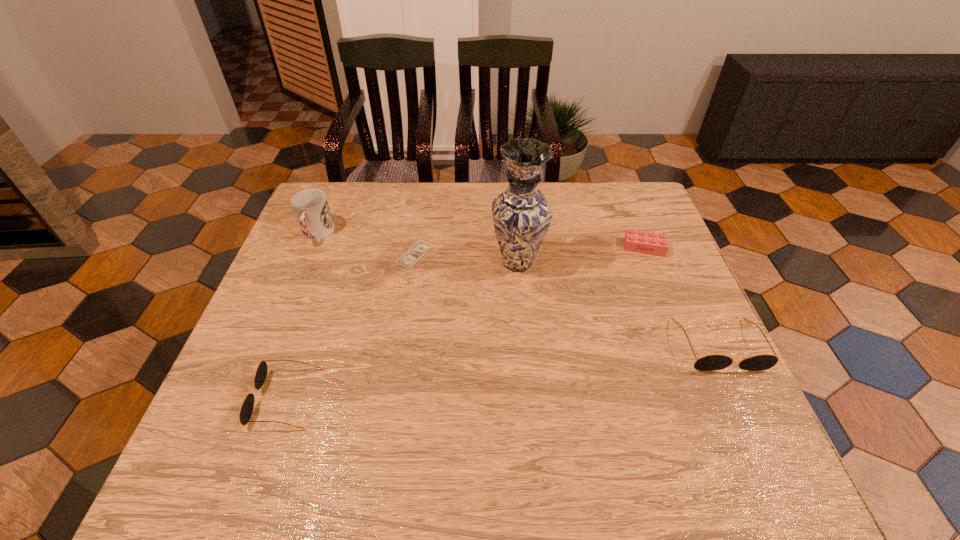
Identify the location of vacant spot for a new sunglasses to ensure equal spacing. [x=513, y=370].